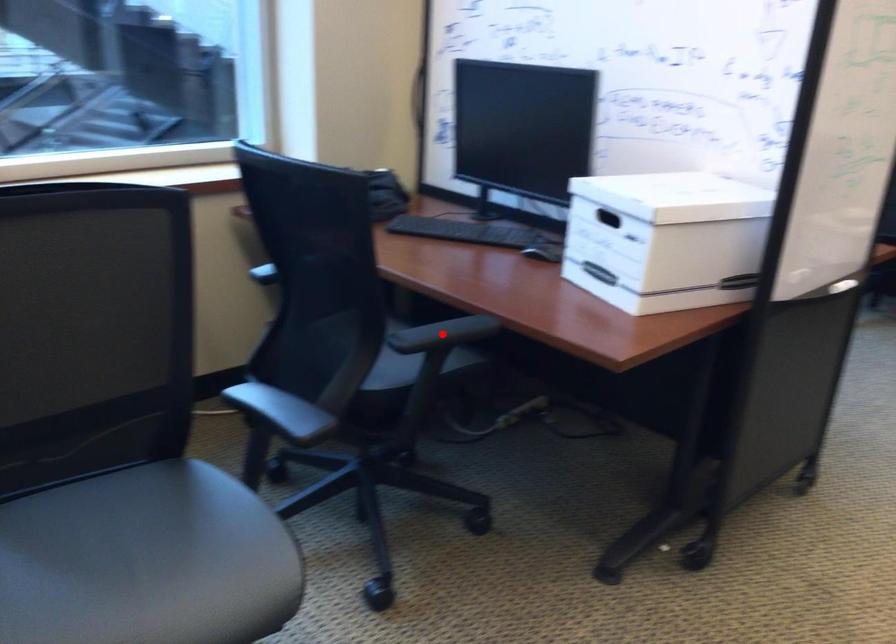
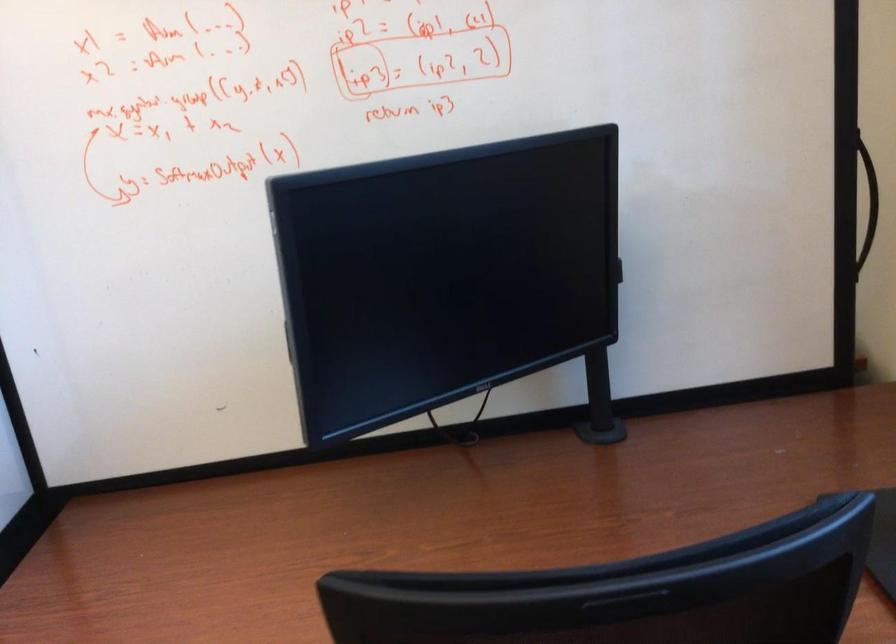
Question: I am providing you with two images of the same scene from different viewpoints. A red point is marked on the first image. Is the red point's position out of view in image 2?

Choices:
 (A) Yes
 (B) No

Answer: (A)